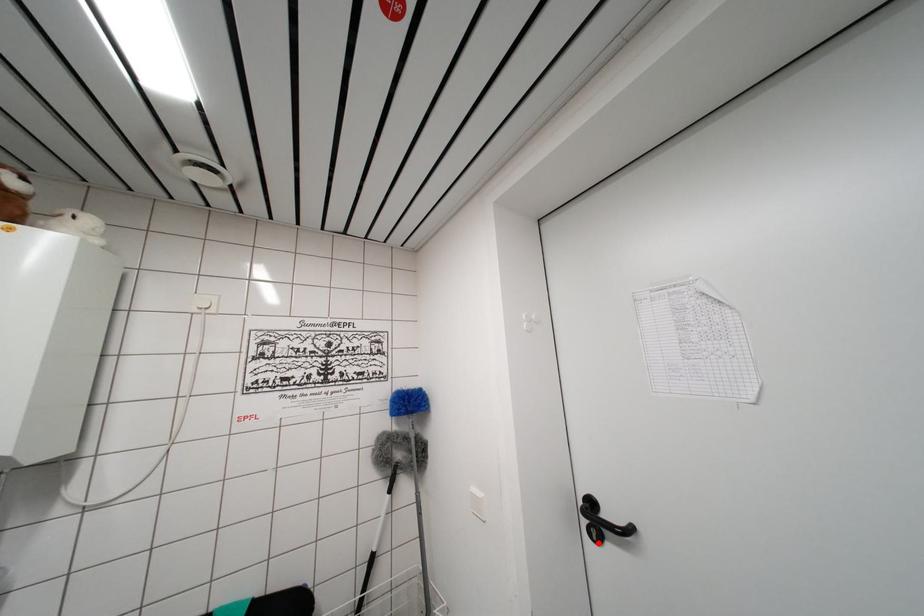
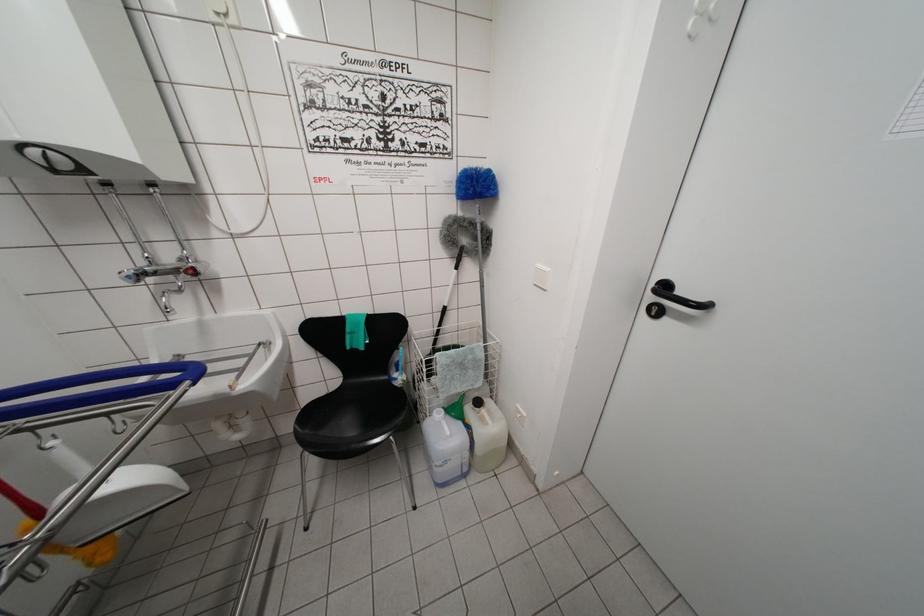
The point at the highlighted location is marked in the first image. Where is the corresponding point in the second image?

(657, 318)